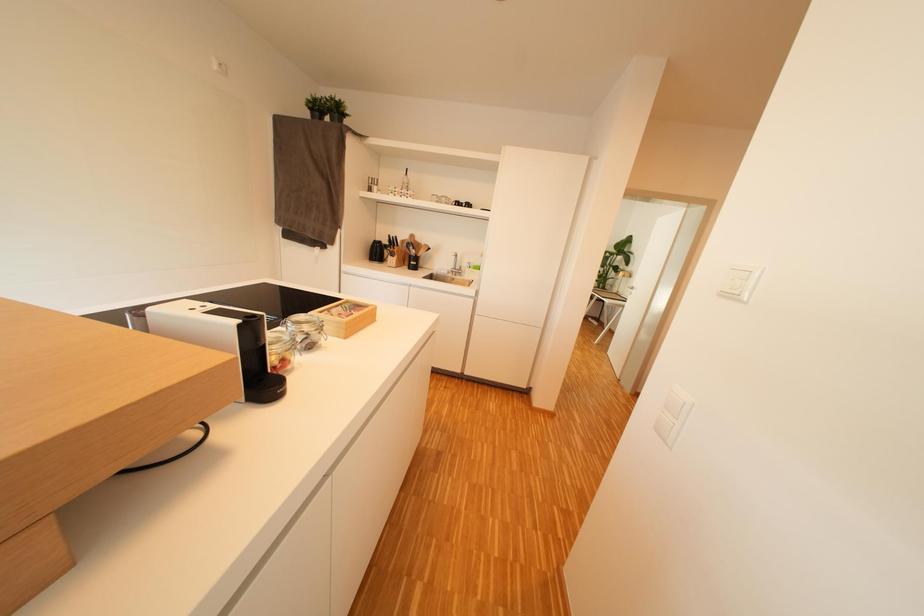
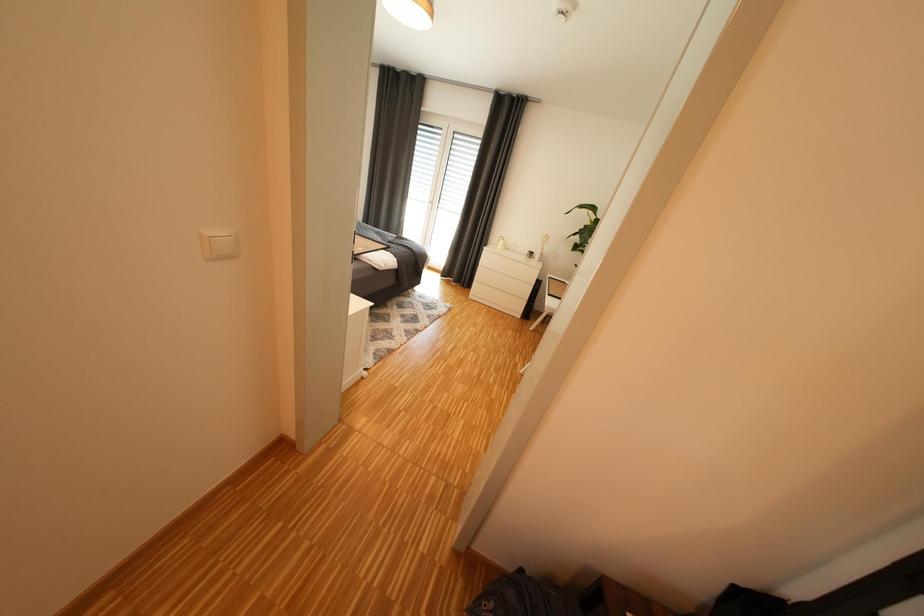
The images are taken continuously from a first-person perspective. In which direction are you moving?

The cameraman moved toward right, forward.